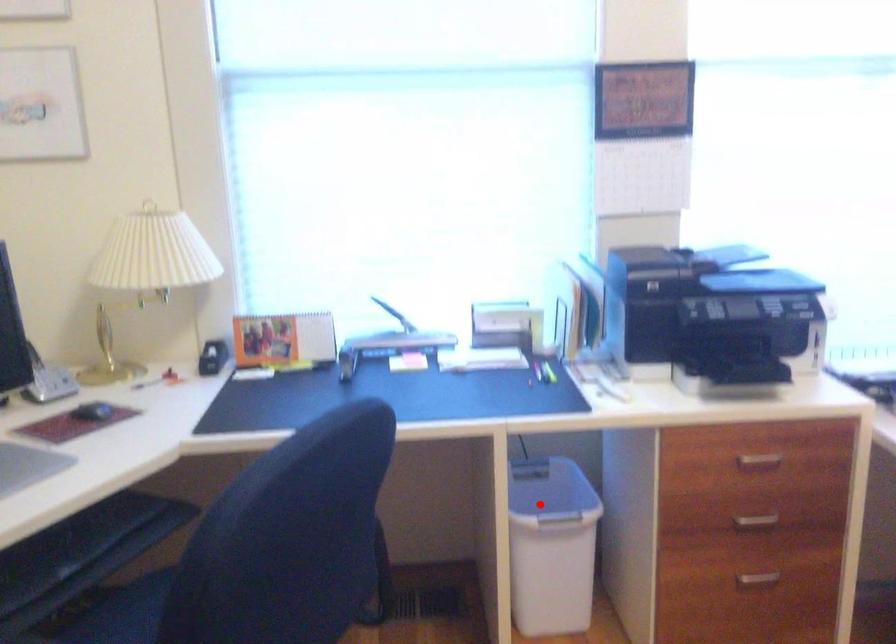
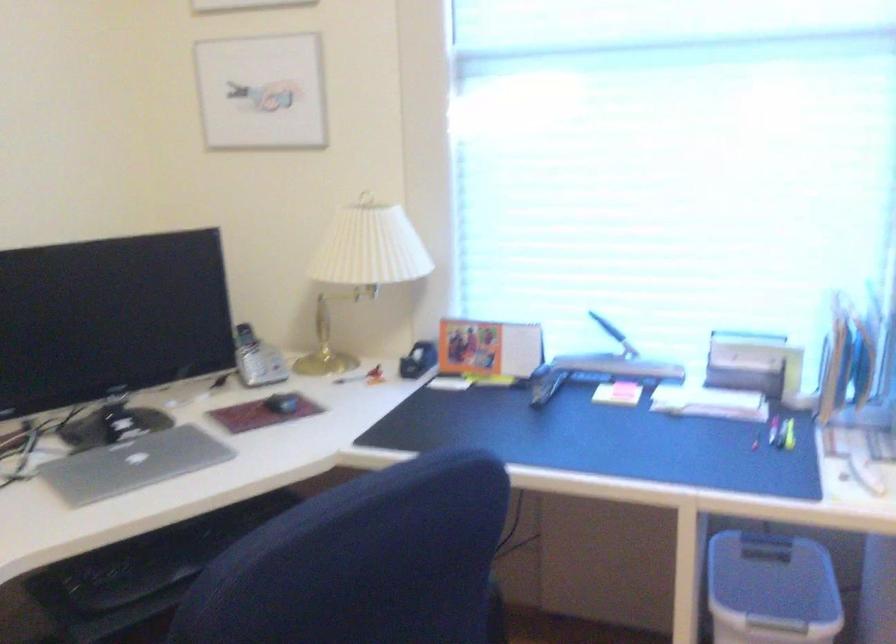
Question: I am providing you with two images of the same scene from different viewpoints. Given a red point in image1, look at the same physical point in image2. Is it:

Choices:
 (A) Closer to the viewpoint
 (B) Farther from the viewpoint

Answer: (A)